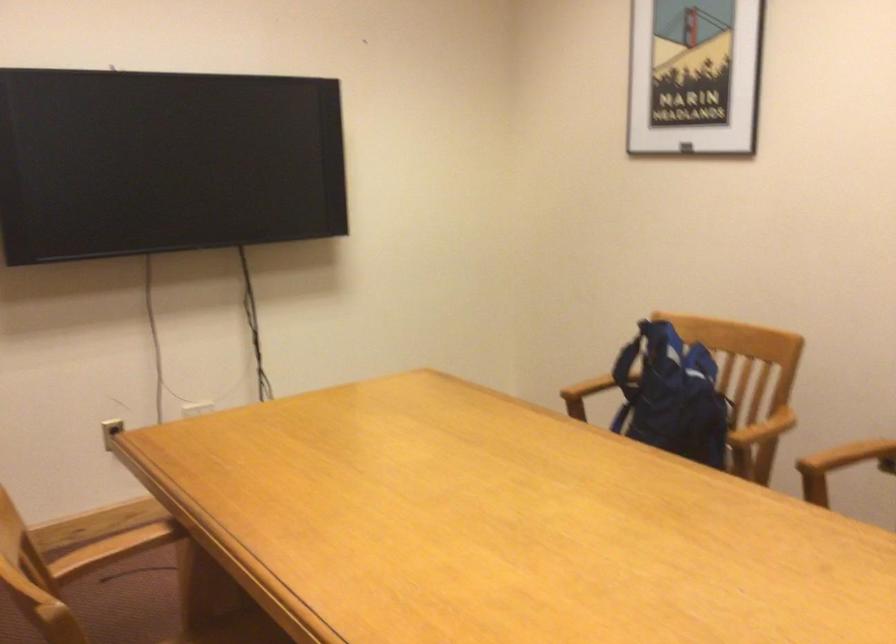
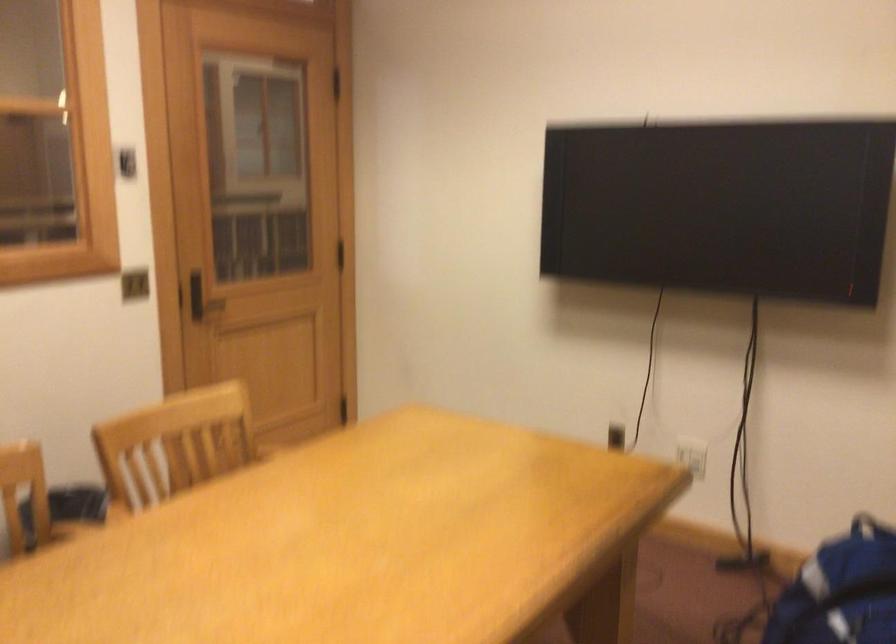
Where in the second image is the point corresponding to (205,410) from the first image?

(692, 455)